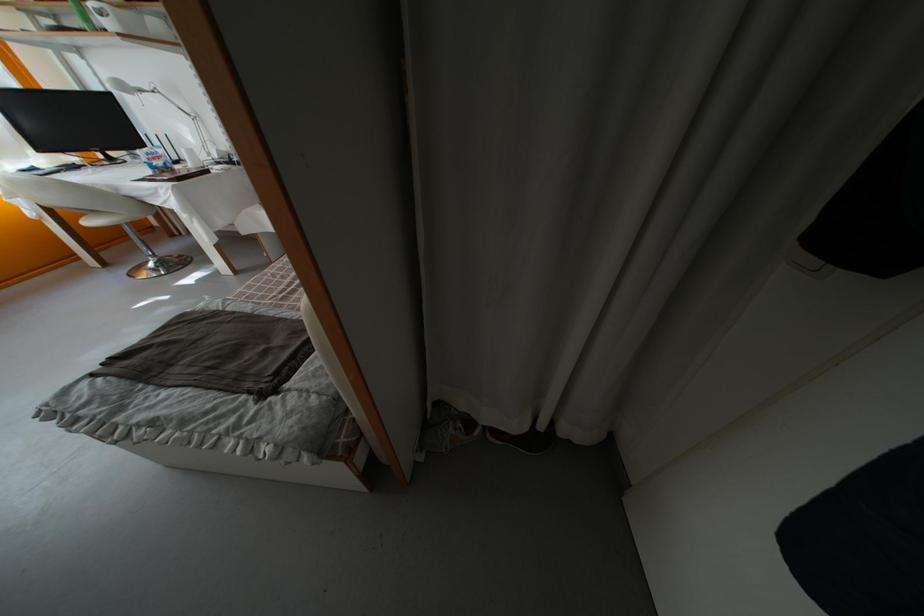
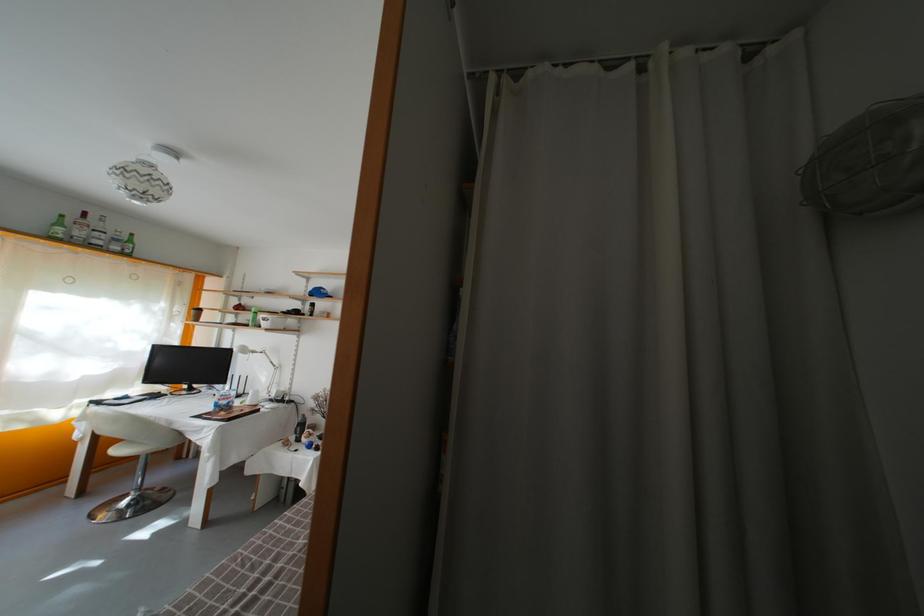
Question: The images are taken continuously from a first-person perspective. In which direction is your viewpoint rotating?

Choices:
 (A) Left
 (B) Right
 (C) Up
 (D) Down

Answer: (C)